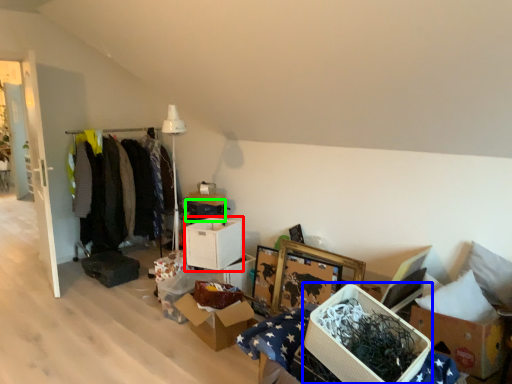
Question: Which object is the closest to the storage box (highlighted by a red box)? Choose among these: storage box (highlighted by a blue box) or storage box (highlighted by a green box).

Choices:
 (A) storage box
 (B) storage box

Answer: (B)